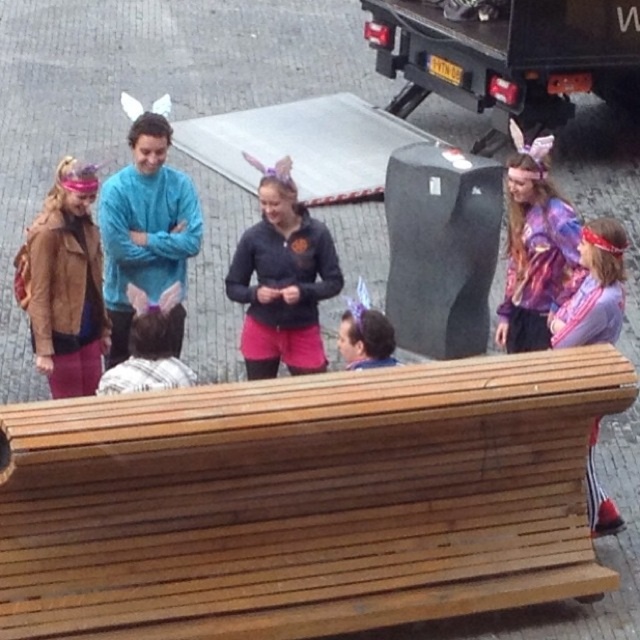
Question: Does matte blue sweater at center have a lesser width compared to matte black hair at center?

Choices:
 (A) no
 (B) yes

Answer: (A)

Question: Can you confirm if purple shiny jacket at right is positioned above matte black hair at center?

Choices:
 (A) no
 (B) yes

Answer: (B)

Question: Which point appears farthest from the camera in this image?

Choices:
 (A) (563, 564)
 (B) (120, 182)
 (C) (179, 316)

Answer: (B)

Question: Is wooden bench at lower center bigger than dark gray fleece jacket at center?

Choices:
 (A) no
 (B) yes

Answer: (B)

Question: Which of the following is the farthest from the observer?

Choices:
 (A) (515, 221)
 (B) (321, 420)

Answer: (A)

Question: Which point appears farthest from the camera in this image?

Choices:
 (A) (564, 344)
 (B) (168, 296)
 (C) (529, 163)

Answer: (C)